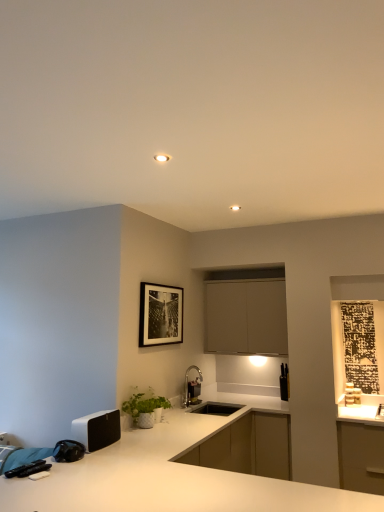
Question: Considering the relative sizes of black matte picture frame at upper center and white matte speaker at lower left, the 1th appliance positioned from the front, in the image provided, is black matte picture frame at upper center wider than white matte speaker at lower left, the 1th appliance positioned from the front,?

Choices:
 (A) no
 (B) yes

Answer: (A)

Question: Considering the relative sizes of black matte picture frame at upper center and white matte speaker at lower left, placed as the third appliance when sorted from right to left, in the image provided, is black matte picture frame at upper center thinner than white matte speaker at lower left, placed as the third appliance when sorted from right to left,?

Choices:
 (A) no
 (B) yes

Answer: (B)

Question: Is black matte picture frame at upper center outside white matte speaker at lower left, the third appliance from the back?

Choices:
 (A) yes
 (B) no

Answer: (A)

Question: From the image's perspective, does black matte picture frame at upper center appear higher than white matte speaker at lower left, the first appliance when ordered from left to right?

Choices:
 (A) no
 (B) yes

Answer: (B)

Question: Is black matte picture frame at upper center with white matte speaker at lower left, the 1th appliance positioned from the front?

Choices:
 (A) yes
 (B) no

Answer: (B)

Question: From the image's perspective, is white matte speaker at lower left, the third appliance from the back, positioned above or below white ceramic plant at lower center?

Choices:
 (A) below
 (B) above

Answer: (B)

Question: Is white matte speaker at lower left, the first appliance when ordered from left to right, bigger or smaller than white ceramic plant at lower center?

Choices:
 (A) small
 (B) big

Answer: (B)

Question: Based on their positions, is white matte speaker at lower left, the first appliance when ordered from left to right, located to the left or right of white ceramic plant at lower center?

Choices:
 (A) left
 (B) right

Answer: (A)

Question: In terms of width, does white matte speaker at lower left, placed as the third appliance when sorted from right to left, look wider or thinner when compared to white ceramic plant at lower center?

Choices:
 (A) thin
 (B) wide

Answer: (B)

Question: Is point (276, 284) positioned closer to the camera than point (283, 374)?

Choices:
 (A) farther
 (B) closer

Answer: (B)

Question: From the image's perspective, is matte white cabinet at center located above or below black matte knife block at right, which appears as the third appliance when viewed from the front?

Choices:
 (A) above
 (B) below

Answer: (A)

Question: From a real-world perspective, is matte white cabinet at center above or below black matte knife block at right, arranged as the first appliance when viewed from the back?

Choices:
 (A) above
 (B) below

Answer: (A)

Question: Considering the positions of matte white cabinet at center and black matte knife block at right, arranged as the first appliance when viewed from the back, in the image, is matte white cabinet at center wider or thinner than black matte knife block at right, arranged as the first appliance when viewed from the back,?

Choices:
 (A) wide
 (B) thin

Answer: (A)

Question: Would you say black matte knife block at right, the 1th appliance in the right-to-left sequence, is inside or outside white ceramic plant at lower center?

Choices:
 (A) inside
 (B) outside

Answer: (B)

Question: From the image's perspective, is black matte knife block at right, arranged as the first appliance when viewed from the back, located above or below white ceramic plant at lower center?

Choices:
 (A) below
 (B) above

Answer: (A)